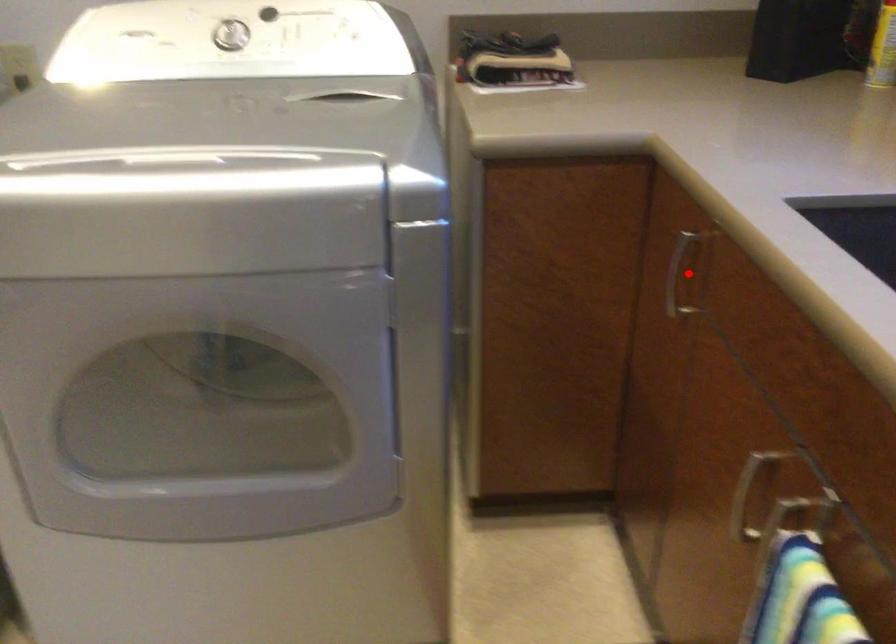
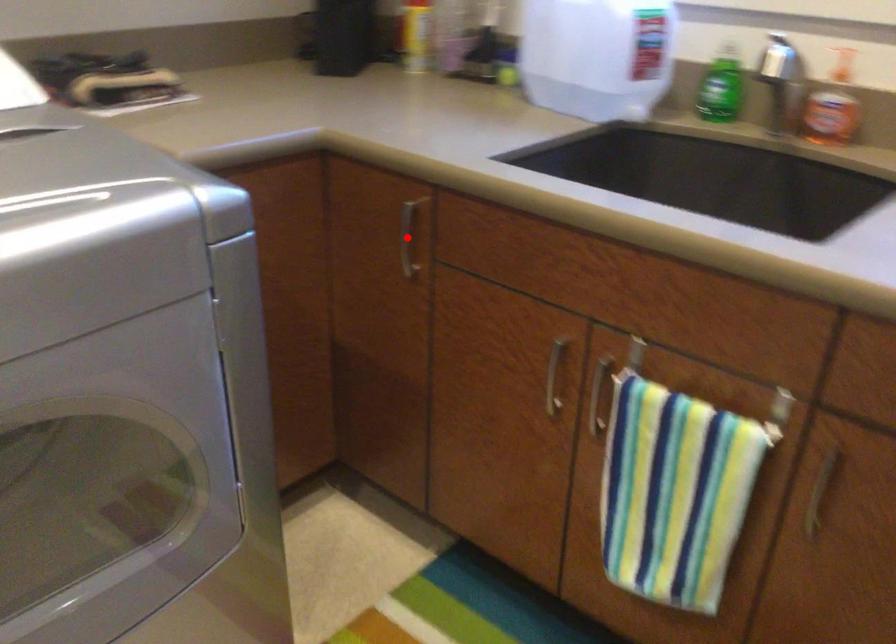
I am providing you with two images of the same scene from different viewpoints. A red point is marked on the first image and another point is marked on the second image. Is the red point in image1 aligned with the point shown in image2?

Yes